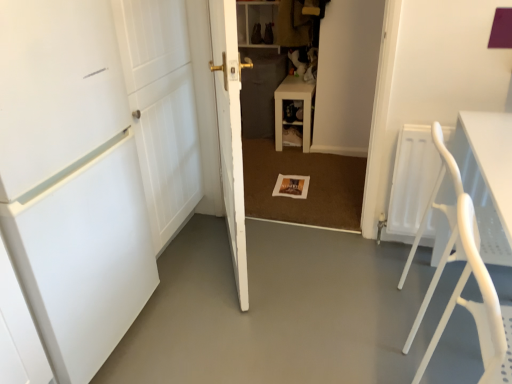
Question: Is wooden shelf at center aimed at smooth concrete floor at center?

Choices:
 (A) no
 (B) yes

Answer: (A)

Question: Is wooden shelf at center looking in the opposite direction of smooth concrete floor at center?

Choices:
 (A) no
 (B) yes

Answer: (A)

Question: From a real-world perspective, does wooden shelf at center stand above smooth concrete floor at center?

Choices:
 (A) no
 (B) yes

Answer: (B)

Question: Is wooden shelf at center positioned far away from smooth concrete floor at center?

Choices:
 (A) yes
 (B) no

Answer: (A)

Question: Can you confirm if wooden shelf at center is shorter than smooth concrete floor at center?

Choices:
 (A) yes
 (B) no

Answer: (B)

Question: Considering the positions of point (258, 327) and point (221, 84), is point (258, 327) closer or farther from the camera than point (221, 84)?

Choices:
 (A) closer
 (B) farther

Answer: (A)

Question: Choose the correct answer: Is smooth concrete floor at center inside white matte door at center, the 1th door from the right, or outside it?

Choices:
 (A) outside
 (B) inside

Answer: (A)

Question: From the image's perspective, is smooth concrete floor at center located above or below white matte door at center, the second door when ordered from left to right?

Choices:
 (A) below
 (B) above

Answer: (A)

Question: In the image, is smooth concrete floor at center positioned in front of or behind white matte door at center, the 1th door from the right?

Choices:
 (A) front
 (B) behind

Answer: (A)

Question: From their relative heights in the image, would you say white matte door at left, which is the 1th door in left-to-right order, is taller or shorter than smooth concrete floor at center?

Choices:
 (A) tall
 (B) short

Answer: (A)

Question: Considering the relative positions of white matte door at left, which is the 1th door in left-to-right order, and smooth concrete floor at center in the image provided, is white matte door at left, which is the 1th door in left-to-right order, to the left or to the right of smooth concrete floor at center?

Choices:
 (A) right
 (B) left

Answer: (B)

Question: From the image's perspective, is white matte door at left, which is the 1th door in left-to-right order, positioned above or below smooth concrete floor at center?

Choices:
 (A) below
 (B) above

Answer: (B)

Question: From a real-world perspective, is white matte door at left, the second door in the right-to-left sequence, positioned above or below smooth concrete floor at center?

Choices:
 (A) below
 (B) above

Answer: (B)

Question: Is wooden shelf at center taller or shorter than white plastic folding chair at right?

Choices:
 (A) short
 (B) tall

Answer: (A)

Question: From the image's perspective, is wooden shelf at center positioned above or below white plastic folding chair at right?

Choices:
 (A) above
 (B) below

Answer: (A)